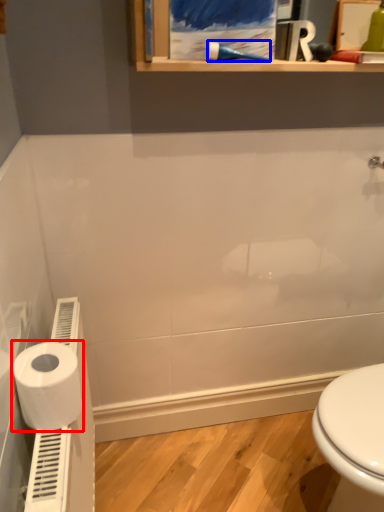
Question: Which point is further to the camera, toilet paper (highlighted by a red box) or shower (highlighted by a blue box)?

Choices:
 (A) toilet paper
 (B) shower

Answer: (B)